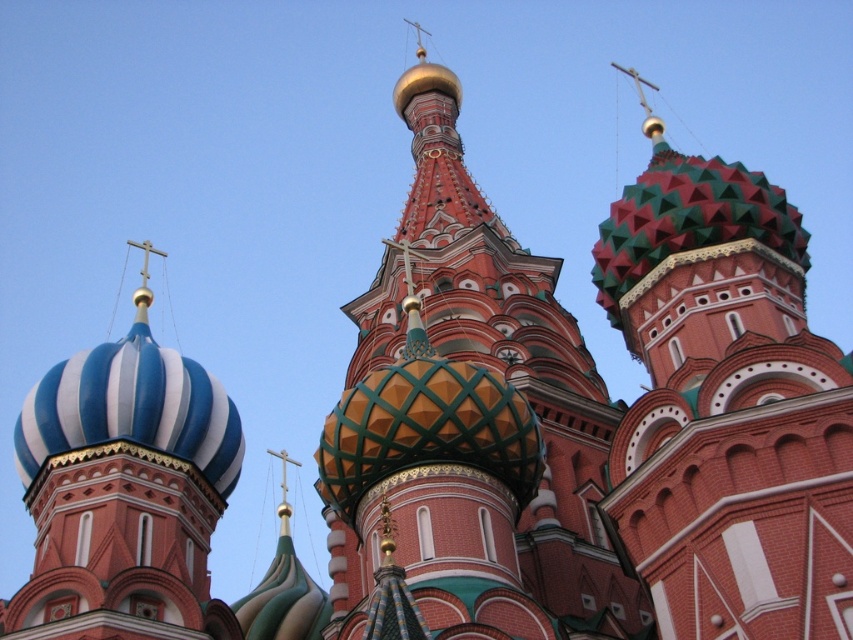
Question: Which of the following is the farthest from the observer?

Choices:
 (A) green and red mosaic dome at center
 (B) multicolored mosaic dome at center

Answer: (A)

Question: Observing the image, what is the correct spatial positioning of multicolored mosaic dome at center in reference to blue and white striped dome at left?

Choices:
 (A) below
 (B) above

Answer: (B)

Question: Which of the following is the closest to the observer?

Choices:
 (A) blue and white striped dome at left
 (B) multicolored mosaic dome at center

Answer: (B)

Question: Observing the image, what is the correct spatial positioning of green and red mosaic dome at center in reference to blue and white striped dome at left?

Choices:
 (A) below
 (B) above

Answer: (B)

Question: Is multicolored mosaic dome at center thinner than blue and white striped dome at left?

Choices:
 (A) yes
 (B) no

Answer: (A)

Question: Which of the following is the farthest from the observer?

Choices:
 (A) (648, 532)
 (B) (154, 356)

Answer: (B)